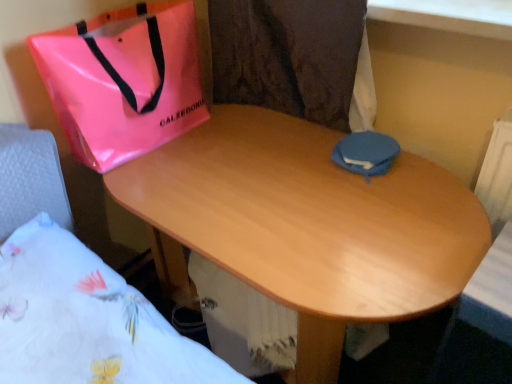
The height and width of the screenshot is (384, 512). I want to click on vacant area that is in front of blue fabric pouch at center, so click(386, 196).